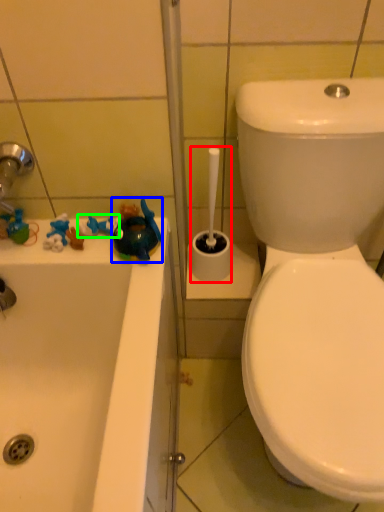
Question: Based on their relative distances, which object is nearer to shower (highlighted by a red box)? Choose from toy (highlighted by a blue box) and toy (highlighted by a green box).

Choices:
 (A) toy
 (B) toy

Answer: (A)